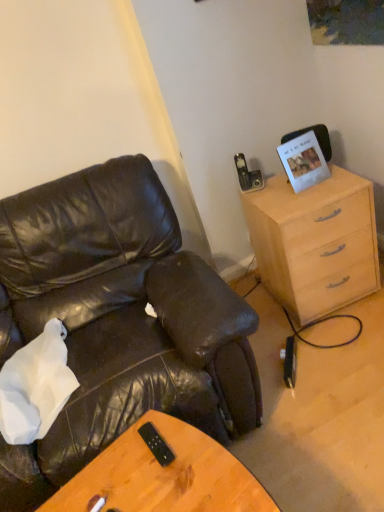
At what (x,y) coordinates should I click in order to perform the action: click on blank space situated above light wood/finish cabinet at right (from a real-world perspective). Please return your answer as a coordinate pair (x, y). This screenshot has width=384, height=512. Looking at the image, I should click on (273, 194).